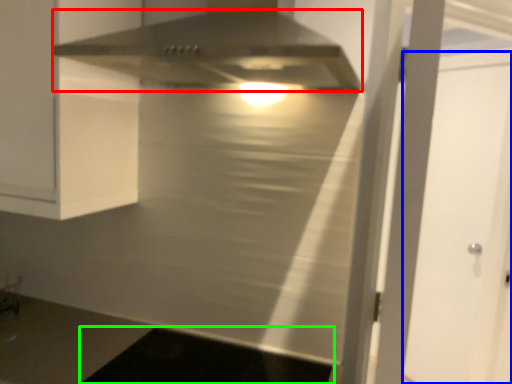
Question: Which is farther away from home appliance (highlighted by a red box)? glass door (highlighted by a blue box) or dark (highlighted by a green box)?

Choices:
 (A) glass door
 (B) dark

Answer: (A)